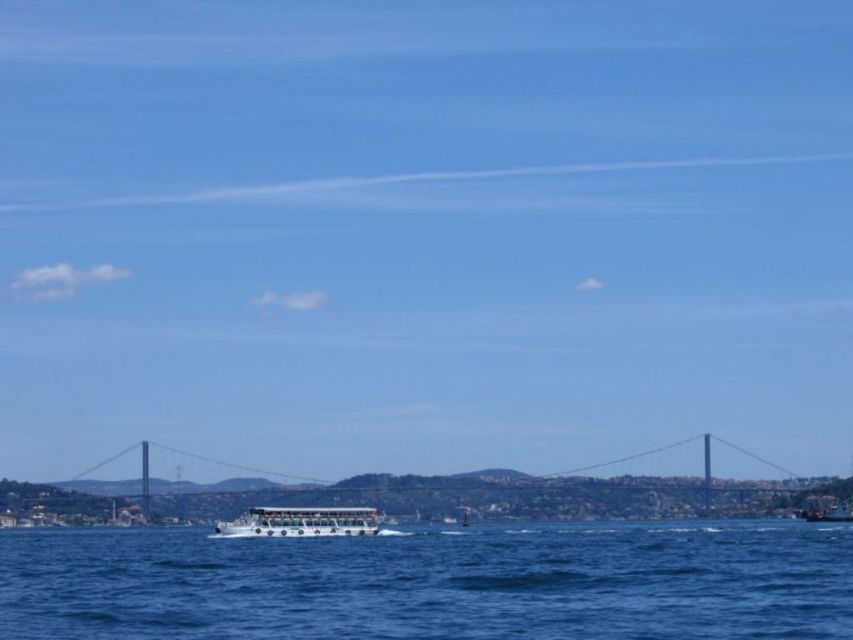
You are a photographer planning to capture the white glossy boat at center and the white plastic boat at lower right in the same frame. Considering their sizes, which boat will appear bigger in your photo?

The white glossy boat at center will appear bigger in the photo because it has a larger size compared to the white plastic boat at lower right.